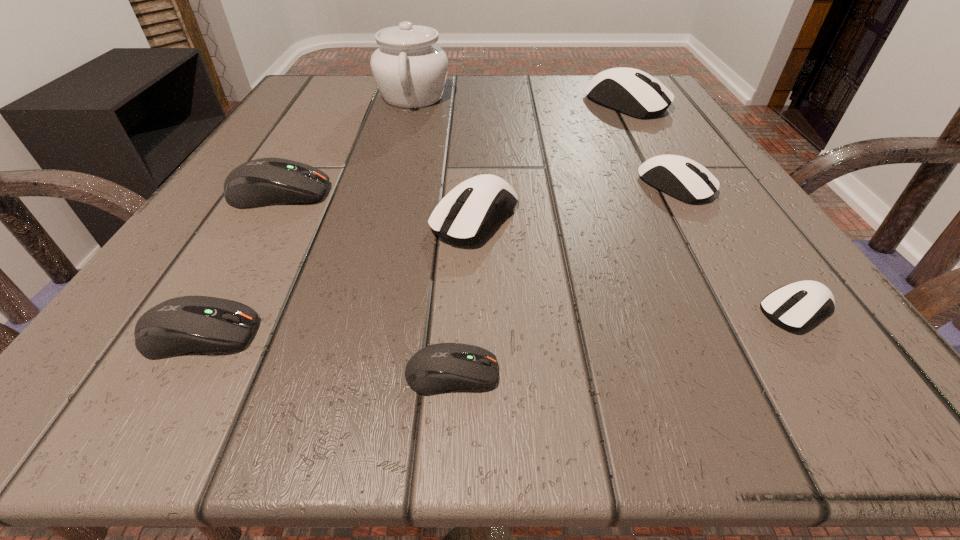
The image size is (960, 540). I want to click on unoccupied position between the farthest computer equipment and the leftmost white mouse, so click(x=550, y=161).

Identify the location of empty space between the second biggest dark computer equipment and the second biggest white mouse. (337, 276).

In order to click on free spot between the second smallest white mouse and the nearest white mouse in this screenshot , I will do `click(736, 248)`.

Where is `vacant space in between the farthest white mouse and the second smallest white mouse`? vacant space in between the farthest white mouse and the second smallest white mouse is located at coordinates (651, 145).

Where is `free space between the third biggest white mouse and the tallest object`? The width and height of the screenshot is (960, 540). free space between the third biggest white mouse and the tallest object is located at coordinates (544, 141).

The height and width of the screenshot is (540, 960). I want to click on free space between the farthest white mouse and the second biggest white mouse, so click(x=550, y=161).

Find the location of a particular element. vacant area between the rightmost dark computer equipment and the white chinaware is located at coordinates (432, 235).

Where is `vacant point located between the third biggest white mouse and the farthest white mouse`? The width and height of the screenshot is (960, 540). vacant point located between the third biggest white mouse and the farthest white mouse is located at coordinates (651, 145).

The image size is (960, 540). I want to click on free space between the white chinaware and the third biggest white mouse, so click(x=544, y=141).

Select which object appears as the fourth closest to the farthest white mouse. Please provide its 2D coordinates. Your answer should be formatted as a tuple, i.e. [(x, y)], where the tuple contains the x and y coordinates of a point satisfying the conditions above.

[(790, 306)]